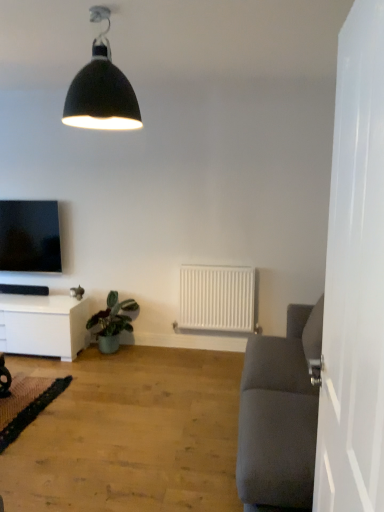
Question: Should I look upward or downward to see green matte plant at lower left?

Choices:
 (A) down
 (B) up

Answer: (A)

Question: Considering the relative positions of wooden floor at lower left and white glossy cabinet at lower left in the image provided, is wooden floor at lower left to the left of white glossy cabinet at lower left from the viewer's perspective?

Choices:
 (A) no
 (B) yes

Answer: (A)

Question: Could you tell me if wooden floor at lower left is turned towards white glossy cabinet at lower left?

Choices:
 (A) yes
 (B) no

Answer: (B)

Question: Is wooden floor at lower left taller than white glossy cabinet at lower left?

Choices:
 (A) no
 (B) yes

Answer: (A)

Question: From a real-world perspective, is wooden floor at lower left over white glossy cabinet at lower left?

Choices:
 (A) no
 (B) yes

Answer: (A)

Question: From the image's perspective, does wooden floor at lower left appear higher than white glossy cabinet at lower left?

Choices:
 (A) no
 (B) yes

Answer: (A)

Question: From the image's perspective, is wooden floor at lower left located beneath white glossy cabinet at lower left?

Choices:
 (A) no
 (B) yes

Answer: (B)

Question: Does matte black tv at left have a greater height compared to white glossy door at right?

Choices:
 (A) yes
 (B) no

Answer: (B)

Question: From a real-world perspective, does matte black tv at left sit lower than white glossy door at right?

Choices:
 (A) yes
 (B) no

Answer: (A)

Question: Is matte black tv at left facing towards white glossy door at right?

Choices:
 (A) yes
 (B) no

Answer: (B)

Question: Is matte black tv at left positioned far away from white glossy door at right?

Choices:
 (A) yes
 (B) no

Answer: (A)

Question: Is matte black tv at left outside of white glossy door at right?

Choices:
 (A) yes
 (B) no

Answer: (A)

Question: From the image's perspective, is matte black tv at left over white glossy door at right?

Choices:
 (A) yes
 (B) no

Answer: (A)

Question: From the image's perspective, does green textured mat at lower left appear higher than matte black tv at left?

Choices:
 (A) yes
 (B) no

Answer: (B)